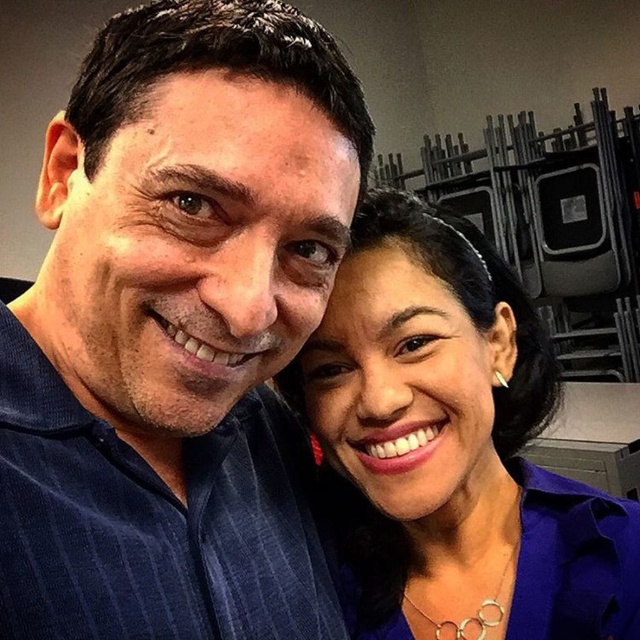
Question: Does blue corduroy shirt at center lie in front of matte purple blouse at center?

Choices:
 (A) no
 (B) yes

Answer: (B)

Question: Can you confirm if blue corduroy shirt at center is wider than matte purple blouse at center?

Choices:
 (A) no
 (B) yes

Answer: (A)

Question: Which object is farther from the camera taking this photo?

Choices:
 (A) blue corduroy shirt at center
 (B) matte purple blouse at center

Answer: (B)

Question: Which object is farther from the camera taking this photo?

Choices:
 (A) matte purple blouse at center
 (B) blue corduroy shirt at center

Answer: (A)

Question: Does blue corduroy shirt at center appear on the left side of matte purple blouse at center?

Choices:
 (A) yes
 (B) no

Answer: (A)